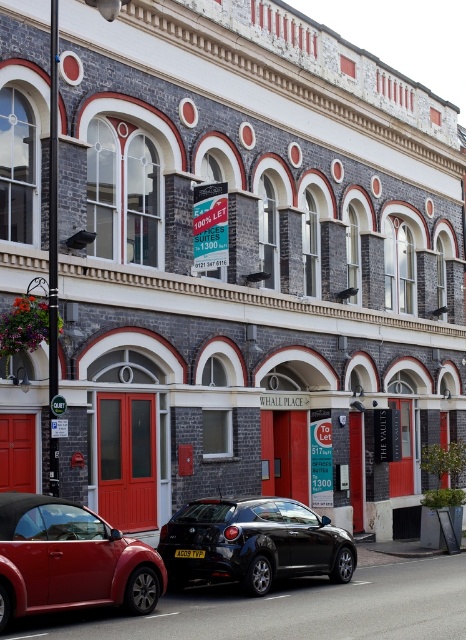
Does shiny red convertible at lower left appear on the right side of shiny black hatchback at center?

In fact, shiny red convertible at lower left is to the left of shiny black hatchback at center.

Based on the photo, how distant is shiny red convertible at lower left from shiny black hatchback at center?

They are 10.38 feet apart.

Between point (48, 593) and point (246, 564), which one is positioned behind?

The point (246, 564) is behind.

Identify the location of shiny red convertible at lower left. This screenshot has height=640, width=466. (69, 561).